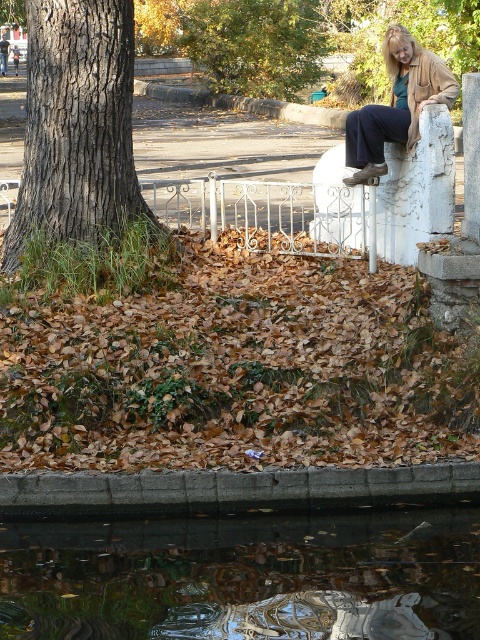
You are standing at the edge of the scene and want to place a small decorative stone on the closest object. Which object should you choose between the reflective glass water at lower center and the concrete ledge at lower center?

The reflective glass water at lower center is closer to the viewer than the concrete ledge at lower center, so you should place the stone on the reflective glass water at lower center.

Consider the image. You are planning to place a small decorative boat in the reflective glass water at lower center. Considering the gray textured bark at left is 1.2 meters wide, can the boat, which is 1.5 meters long, fit inside the water without touching the bark?

The reflective glass water at lower center might be wider than the gray textured bark at left, but since the bark is 1.2 meters wide and the boat is 1.5 meters long, there is a possibility that the boat may not fit entirely within the water if the water is only as wide as the bark. However, if the water is indeed wider, it could accommodate the boat. Without exact measurements, it is uncertain.

You are standing at the center of the image and want to take a photo of the gray textured bark at left. Based on its coordinates, in which direction should you move to get the best view?

The gray textured bark at left is located at coordinates point (76, 124), so you should move to the left side to get the best view of it.